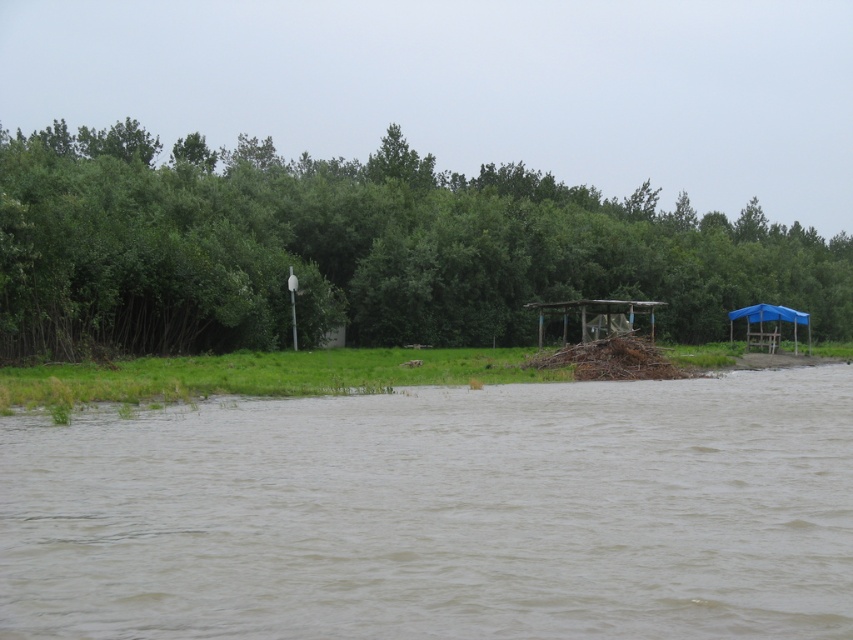
You are a hiker trying to cross the brown muddy water at lower center to reach the green leafy trees at upper center. Considering their heights, is the water level safe for walking?

The brown muddy water at lower center has a lesser height compared to green leafy trees at upper center. Since the water is lower, it might be shallow enough to walk through, but caution is advised due to the muddy terrain.

You are a hiker trying to cross the brown muddy water at lower center to reach the green leafy trees at upper center. The path between them is 66.68 meters. If your average walking speed is 1.5 meters per second, how many minutes will it take you to cross the distance?

The distance between the brown muddy water at lower center and the green leafy trees at upper center is 66.68 meters. At a speed of 1.5 meters per second, dividing 66.68 by 1.5 gives approximately 44.45 seconds. Converting seconds to minutes, this is roughly 0.74 minutes. However, since the question asks for minutes, it would take about 0.74 minutes, which is approximately 44.45 seconds. But since the question specifies minutes, rounding to two decimal places, it would be approximately 0.74 minutes.